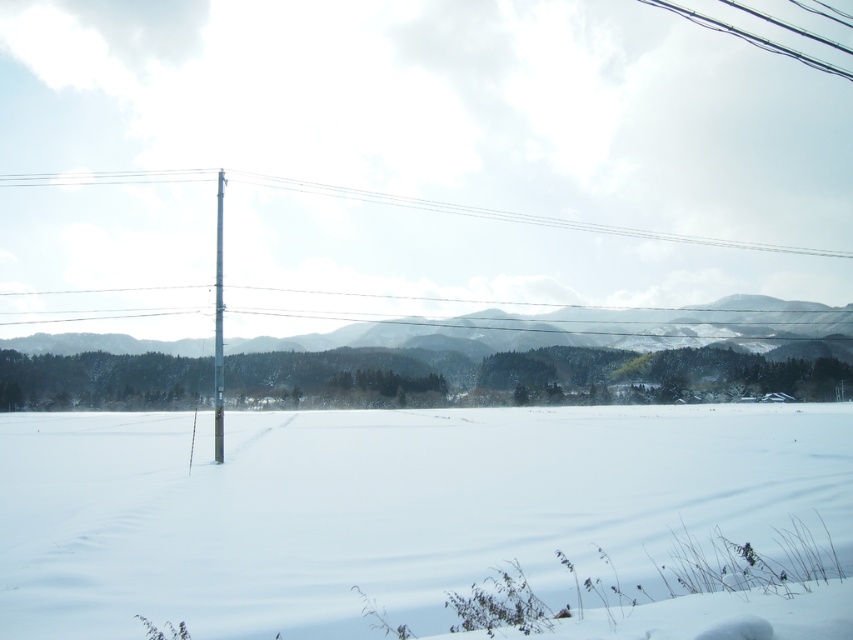
Does metallic gray pole at center-left appear on the right side of metallic silver pole at left?

No, metallic gray pole at center-left is not to the right of metallic silver pole at left.

Is point (218, 214) less distant than point (215, 266)?

No, (218, 214) is behind (215, 266).

Identify the location of metallic gray pole at center-left. The height and width of the screenshot is (640, 853). (218, 324).

Is snowy forested mountain at left taller than metallic gray pole at center-left?

No, snowy forested mountain at left is not taller than metallic gray pole at center-left.

Image resolution: width=853 pixels, height=640 pixels. I want to click on snowy forested mountain at left, so click(567, 353).

Find the location of a particular element. Image resolution: width=853 pixels, height=640 pixels. snowy forested mountain at left is located at coordinates [x=567, y=353].

Does point (65, 500) come closer to viewer compared to point (218, 186)?

Yes, point (65, 500) is closer to viewer.

Who is positioned more to the left, white fluffy snow at center or metallic silver pole at left?

Positioned to the left is metallic silver pole at left.

Does point (335, 579) lie behind point (213, 397)?

No, (335, 579) is in front of (213, 397).

Find the location of a particular element. This screenshot has height=640, width=853. white fluffy snow at center is located at coordinates (383, 508).